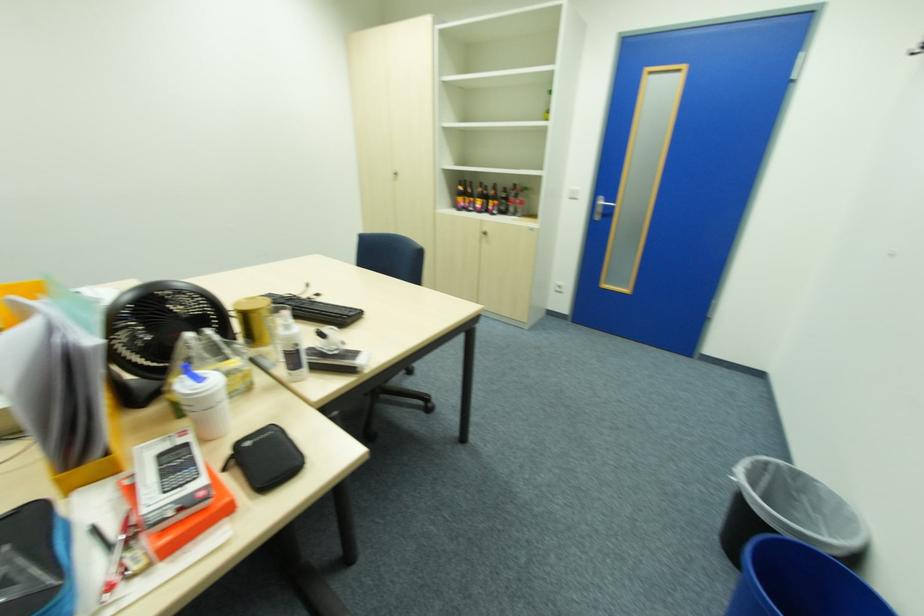
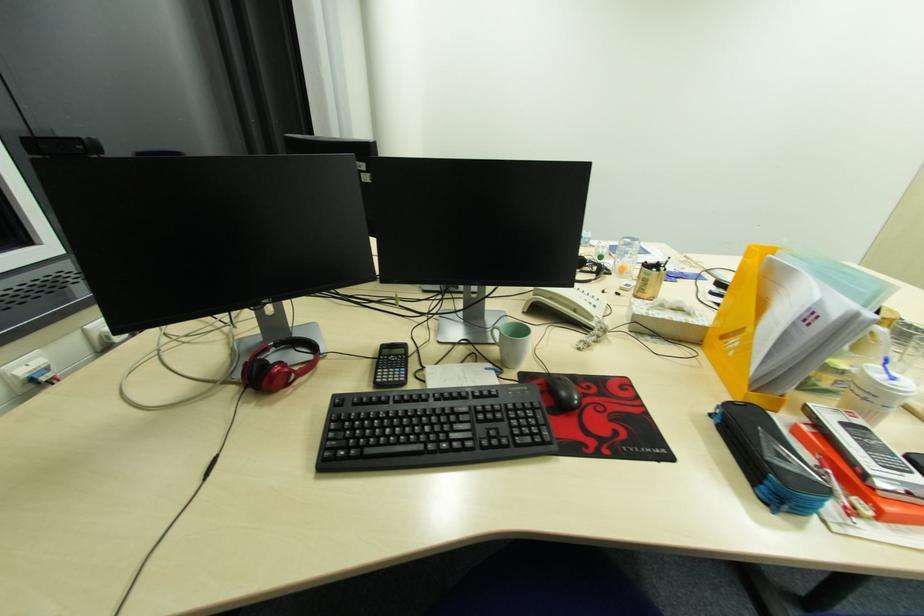
Question: How did the camera likely rotate?

Choices:
 (A) Left
 (B) Right
 (C) Up
 (D) Down

Answer: (A)